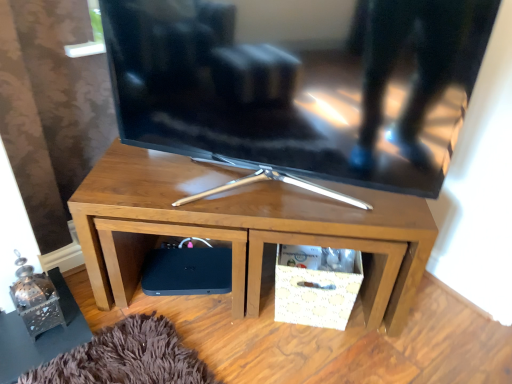
Find the location of a particular element. The width and height of the screenshot is (512, 384). vacant region in front of black matte speaker at lower left is located at coordinates click(x=175, y=336).